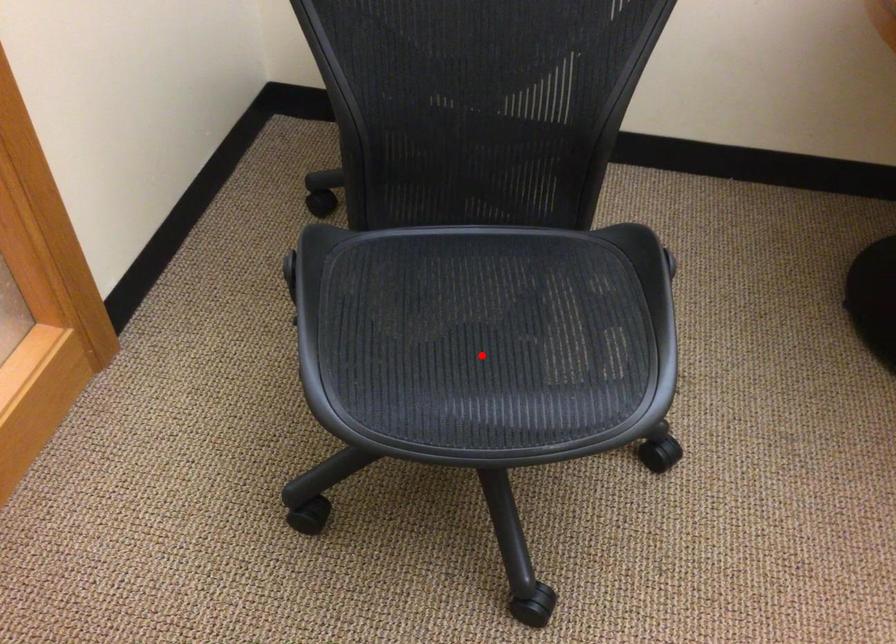
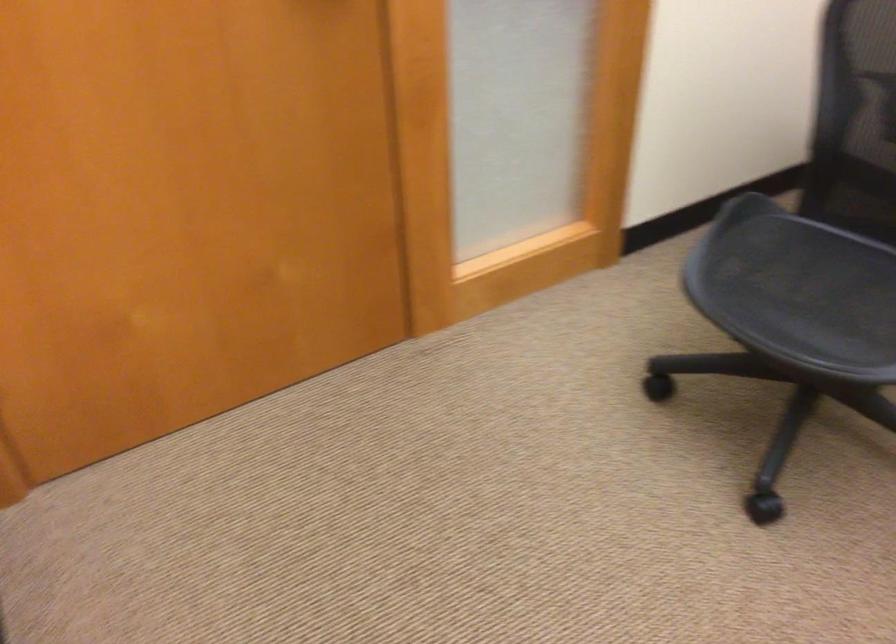
Question: I am providing you with two images of the same scene from different viewpoints. Image1 has a red point marked. In image2, the corresponding 3D location appears at what relative position? Reply with the corresponding letter.

Choices:
 (A) Closer
 (B) Farther

Answer: (B)